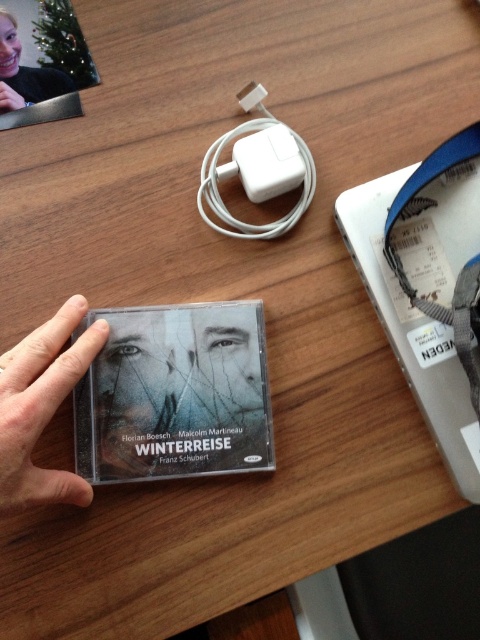
Question: Among these objects, which one is nearest to the camera?

Choices:
 (A) white plastic charger at center
 (B) smooth skin hand at lower left

Answer: (B)

Question: Is smooth skin hand at lower left behind matte black face at upper left?

Choices:
 (A) no
 (B) yes

Answer: (A)

Question: Can you confirm if smooth skin hand at lower left is positioned above matte black face at upper left?

Choices:
 (A) yes
 (B) no

Answer: (B)

Question: Considering the real-world distances, which object is farthest from the matte black face at upper left?

Choices:
 (A) smooth skin hand at lower left
 (B) white plastic charger at center

Answer: (A)

Question: From the image, what is the correct spatial relationship of white plastic charger at center in relation to matte black face at upper left?

Choices:
 (A) left
 (B) right

Answer: (B)

Question: Which object is farther from the camera taking this photo?

Choices:
 (A) white plastic charger at center
 (B) smooth skin hand at lower left

Answer: (A)